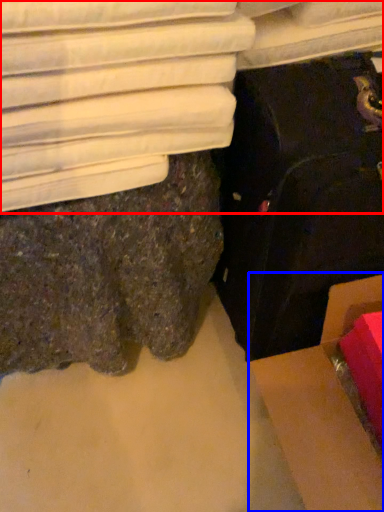
Question: Which point is closer to the camera, furniture (highlighted by a red box) or cardboard box (highlighted by a blue box)?

Choices:
 (A) furniture
 (B) cardboard box

Answer: (A)